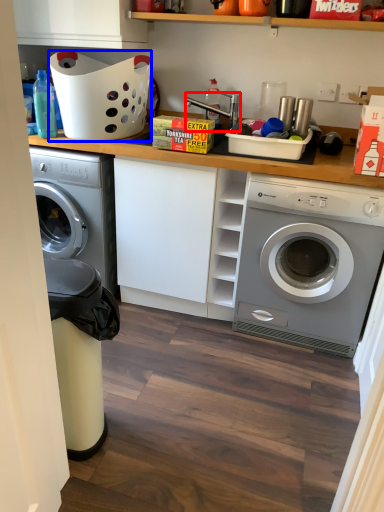
Question: Which object appears closest to the camera in this image, sink (highlighted by a red box) or basket (highlighted by a blue box)?

Choices:
 (A) sink
 (B) basket

Answer: (B)